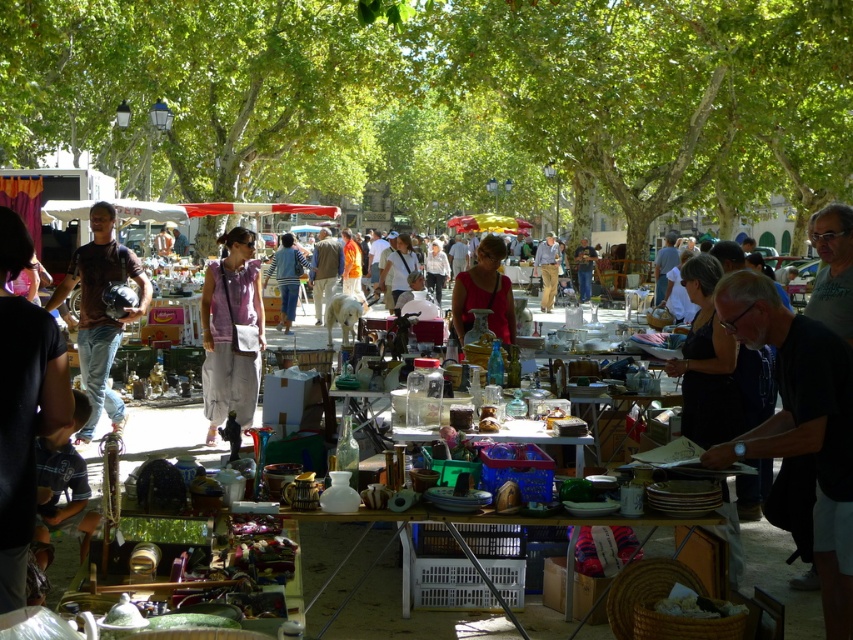
You are a customer at the flea market and want to pick up both the purple cotton shirt at center and the matte black helmet at left. Which item should you walk towards first if you are currently standing at the entrance of the market?

You should walk towards the purple cotton shirt at center first because it is closer to you than the matte black helmet at left, as the purple cotton shirt at center is further to the viewer than the matte black helmet at left.

You are organizing a flea market booth and need to decide which item to place on a small shelf. You have the matte black helmet at left and the matte red blouse at center. Which item should you choose if you want to maximize the shelf space?

The matte black helmet at left is larger in size than the matte red blouse at center, so you should place the matte black helmet at left on the shelf to maximize the space used.